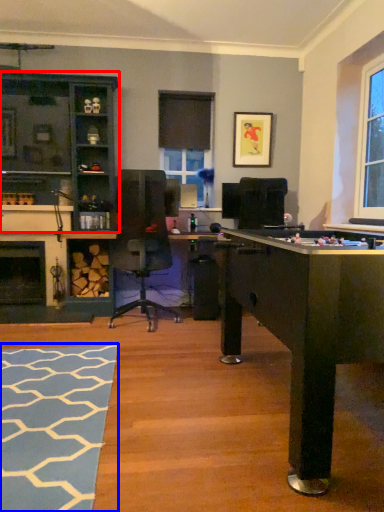
Question: Which object appears farthest to the camera in this image, cabinetry (highlighted by a red box) or flat (highlighted by a blue box)?

Choices:
 (A) cabinetry
 (B) flat

Answer: (A)